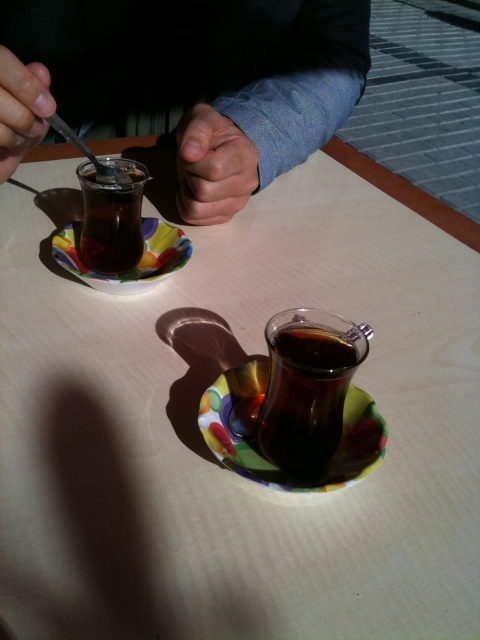
Does multicolored ceramic saucer at center have a lesser width compared to translucent glass cup at left?

No.

Between multicolored ceramic saucer at center and translucent glass cup at left, which one appears on the left side from the viewer's perspective?

From the viewer's perspective, translucent glass cup at left appears more on the left side.

Is point (263, 388) closer to viewer compared to point (131, 209)?

Yes, point (263, 388) is in front of point (131, 209).

The image size is (480, 640). Identify the location of multicolored ceramic saucer at center. (257, 445).

Can you confirm if transparent glass cup at center is bigger than multicolored ceramic saucer at lower left?

No.

Who is more forward, (350, 328) or (73, 221)?

Point (350, 328) is more forward.

Describe the element at coordinates (308, 388) in the screenshot. The width and height of the screenshot is (480, 640). I see `transparent glass cup at center` at that location.

You are a GUI agent. You are given a task and a screenshot of the screen. Output one action in this format:
    pyautogui.click(x=<x>, y=<y>)
    Task: Click on the transparent glass cup at center
    The height and width of the screenshot is (640, 480).
    Given the screenshot: What is the action you would take?
    pyautogui.click(x=308, y=388)

Does transparent glass cup at center appear over skinny-fingered hand at center?

No, transparent glass cup at center is not above skinny-fingered hand at center.

Does point (284, 364) lie behind point (252, 145)?

No, (284, 364) is in front of (252, 145).

At what (x,y) coordinates should I click in order to perform the action: click on transparent glass cup at center. Please return your answer as a coordinate pair (x, y). Looking at the image, I should click on (308, 388).